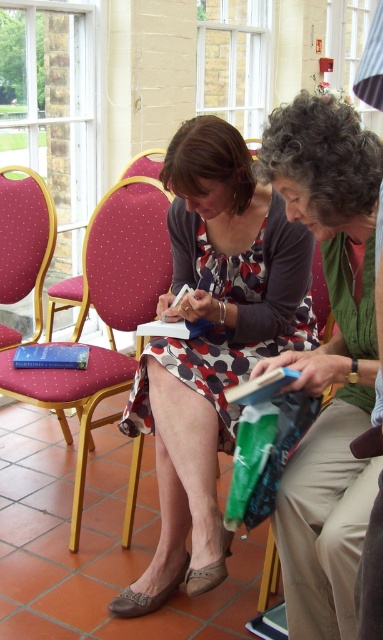
Question: Considering the relative positions of green knitted sweater at center and blue hardcover book at center in the image provided, where is green knitted sweater at center located with respect to blue hardcover book at center?

Choices:
 (A) left
 (B) right

Answer: (B)

Question: Considering the real-world distances, which object is closest to the matte pink fabric armchair at left?

Choices:
 (A) blue hardcover book at center
 (B) polka dot dress at center

Answer: (A)

Question: Among these points, which one is nearest to the camera?

Choices:
 (A) (130, 509)
 (B) (60, 360)

Answer: (A)

Question: Which point appears closest to the camera in this image?

Choices:
 (A) pyautogui.click(x=132, y=296)
 (B) pyautogui.click(x=47, y=358)

Answer: (B)

Question: Is green knitted sweater at center further to the viewer compared to blue hardcover book at center?

Choices:
 (A) no
 (B) yes

Answer: (A)

Question: Is polka dot dress at center to the right of matte pink fabric armchair at left from the viewer's perspective?

Choices:
 (A) no
 (B) yes

Answer: (B)